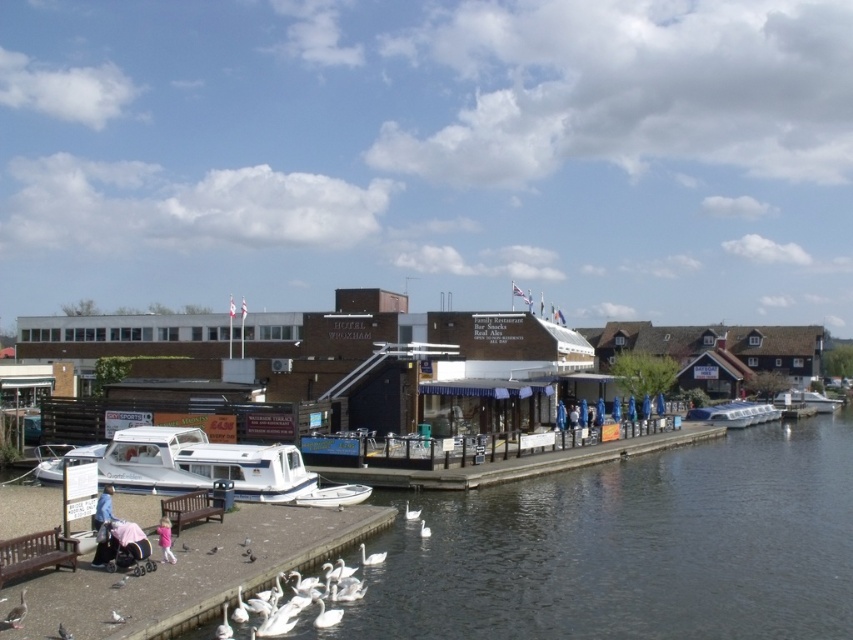
Who is lower down, brown wooden bench at lower left or white plastic boat at center?

white plastic boat at center

Is point (50, 561) closer to viewer compared to point (808, 396)?

Yes, it is in front of point (808, 396).

Locate an element on the screen. This screenshot has height=640, width=853. brown wooden bench at lower left is located at coordinates (35, 554).

Is white glossy boat at lower left to the left of white glossy boat at center from the viewer's perspective?

Indeed, white glossy boat at lower left is positioned on the left side of white glossy boat at center.

Who is more distant from viewer, (189, 470) or (750, 401)?

The point (750, 401) is behind.

What are the coordinates of `white glossy boat at lower left` in the screenshot? It's located at (202, 467).

The image size is (853, 640). Identify the location of smooth wooden dock at lower left. (190, 573).

Is smooth wooden dock at lower left positioned before brown wooden bench at lower left?

Yes, it is in front of brown wooden bench at lower left.

At what (x,y) coordinates should I click in order to perform the action: click on smooth wooden dock at lower left. Please return your answer as a coordinate pair (x, y). Looking at the image, I should click on (190, 573).